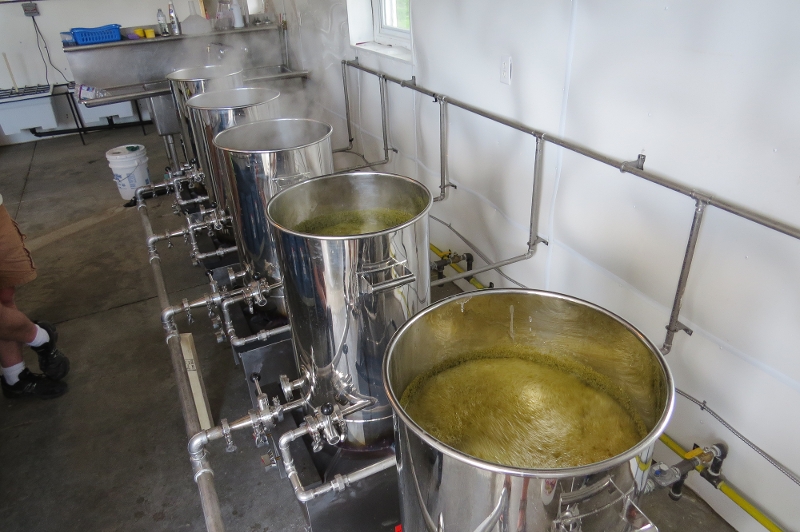
Image resolution: width=800 pixels, height=532 pixels. Identify the location of wall. (740, 149).